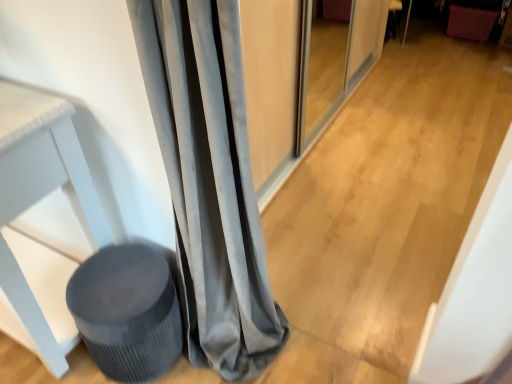
Question: From the image's perspective, is matte gray stool at lower left located beneath velvet gray curtain at left?

Choices:
 (A) no
 (B) yes

Answer: (B)

Question: Considering the relative sizes of matte gray stool at lower left and velvet gray curtain at left in the image provided, is matte gray stool at lower left smaller than velvet gray curtain at left?

Choices:
 (A) yes
 (B) no

Answer: (A)

Question: From a real-world perspective, is matte gray stool at lower left located beneath velvet gray curtain at left?

Choices:
 (A) yes
 (B) no

Answer: (A)

Question: From a real-world perspective, is matte gray stool at lower left physically above velvet gray curtain at left?

Choices:
 (A) no
 (B) yes

Answer: (A)

Question: Is matte gray stool at lower left not close to velvet gray curtain at left?

Choices:
 (A) no
 (B) yes

Answer: (A)

Question: Is velvet gray curtain at left in front of or behind velvet burgundy swivel chair at upper right in the image?

Choices:
 (A) behind
 (B) front

Answer: (B)

Question: In terms of width, does velvet gray curtain at left look wider or thinner when compared to velvet burgundy swivel chair at upper right?

Choices:
 (A) wide
 (B) thin

Answer: (B)

Question: From a real-world perspective, is velvet gray curtain at left positioned above or below velvet burgundy swivel chair at upper right?

Choices:
 (A) below
 (B) above

Answer: (B)

Question: From their relative heights in the image, would you say velvet gray curtain at left is taller or shorter than velvet burgundy swivel chair at upper right?

Choices:
 (A) short
 (B) tall

Answer: (B)

Question: From the image's perspective, is velvet gray curtain at left above or below matte gray stool at lower left?

Choices:
 (A) below
 (B) above

Answer: (B)

Question: Is velvet gray curtain at left inside or outside of matte gray stool at lower left?

Choices:
 (A) inside
 (B) outside

Answer: (B)

Question: From a real-world perspective, is velvet gray curtain at left positioned above or below matte gray stool at lower left?

Choices:
 (A) above
 (B) below

Answer: (A)

Question: Visually, is velvet gray curtain at left positioned to the left or to the right of matte gray stool at lower left?

Choices:
 (A) left
 (B) right

Answer: (B)

Question: Does point (470, 24) appear closer or farther from the camera than point (248, 34)?

Choices:
 (A) farther
 (B) closer

Answer: (A)

Question: Is velvet burgundy swivel chair at upper right bigger or smaller than matte gray screen door at center?

Choices:
 (A) big
 (B) small

Answer: (B)